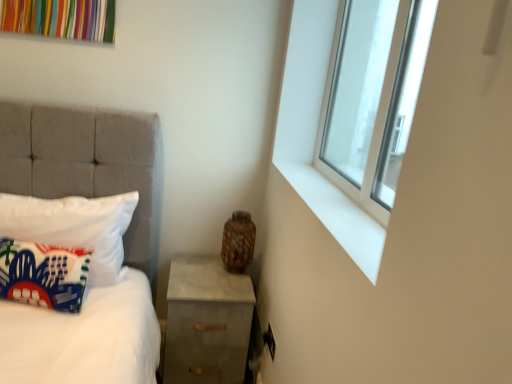
Locate an element on the screen. vacant space that is to the left of brown textured vase at lower right is located at coordinates (193, 267).